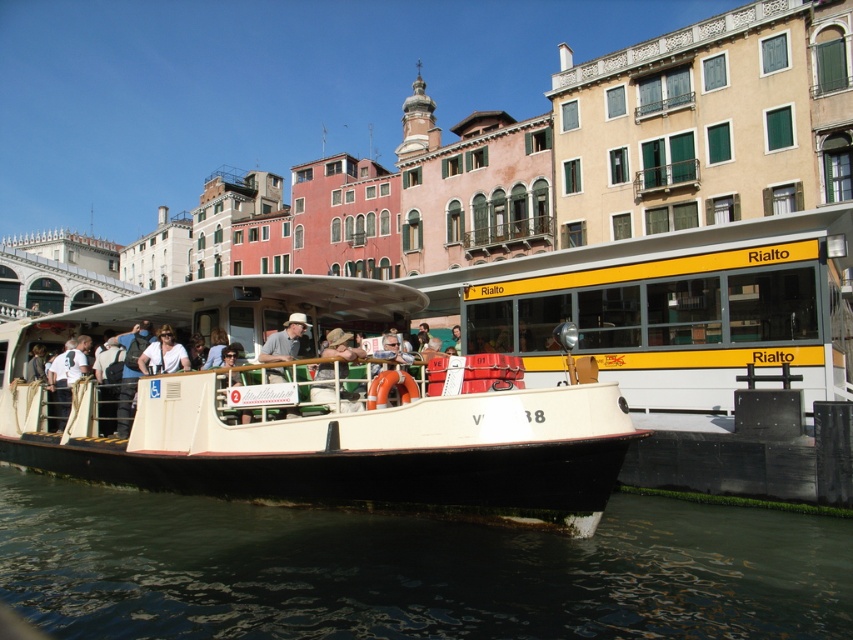
Is khaki fabric hat at center positioned before matte white shirt at center?

That is True.

Does point (325, 403) lie behind point (178, 346)?

That is False.

Describe the element at coordinates (340, 349) in the screenshot. This screenshot has height=640, width=853. I see `khaki fabric hat at center` at that location.

This screenshot has width=853, height=640. Find the location of `khaki fabric hat at center`. khaki fabric hat at center is located at coordinates (340, 349).

Who is higher up, greenish water at lower left or matte white shirt at center?

matte white shirt at center is above.

Can you confirm if greenish water at lower left is wider than matte white shirt at center?

Correct, the width of greenish water at lower left exceeds that of matte white shirt at center.

Is point (86, 499) closer to camera compared to point (189, 364)?

No, it is not.

You are a GUI agent. You are given a task and a screenshot of the screen. Output one action in this format:
    pyautogui.click(x=<x>, y=<y>)
    Task: Click on the greenish water at lower left
    
    Given the screenshot: What is the action you would take?
    pyautogui.click(x=410, y=570)

Is greenish water at lower left to the right of white matte boat at center from the viewer's perspective?

Indeed, greenish water at lower left is positioned on the right side of white matte boat at center.

Is point (462, 572) positioned in front of point (241, 436)?

Yes, it is.

Is point (392, 550) in front of point (212, 496)?

Yes, it is.

The width and height of the screenshot is (853, 640). Find the location of `greenish water at lower left`. greenish water at lower left is located at coordinates (410, 570).